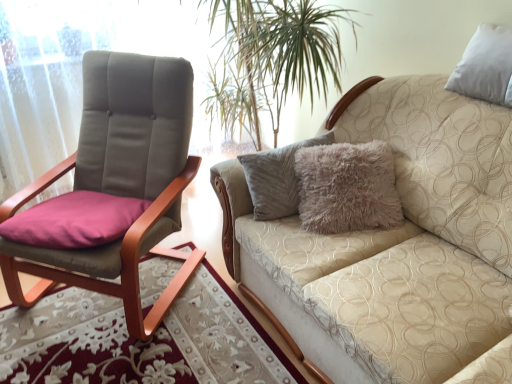
Question: From a real-world perspective, does matte gray fabric chair at left stand above beige textured couch at upper right?

Choices:
 (A) no
 (B) yes

Answer: (B)

Question: Is matte gray fabric chair at left wider than beige textured couch at upper right?

Choices:
 (A) yes
 (B) no

Answer: (B)

Question: Considering the relative positions of matte gray fabric chair at left and beige textured couch at upper right in the image provided, is matte gray fabric chair at left to the left of beige textured couch at upper right from the viewer's perspective?

Choices:
 (A) yes
 (B) no

Answer: (A)

Question: Can you see matte gray fabric chair at left touching beige textured couch at upper right?

Choices:
 (A) no
 (B) yes

Answer: (A)

Question: Considering the relative sizes of matte gray fabric chair at left and beige textured couch at upper right in the image provided, is matte gray fabric chair at left smaller than beige textured couch at upper right?

Choices:
 (A) no
 (B) yes

Answer: (B)

Question: Considering the relative sizes of matte gray fabric chair at left and beige textured couch at upper right in the image provided, is matte gray fabric chair at left thinner than beige textured couch at upper right?

Choices:
 (A) yes
 (B) no

Answer: (A)

Question: Is beige textured couch at upper right positioned beyond the bounds of matte gray fabric chair at left?

Choices:
 (A) no
 (B) yes

Answer: (B)

Question: Is beige textured couch at upper right to the right of matte gray fabric chair at left from the viewer's perspective?

Choices:
 (A) no
 (B) yes

Answer: (B)

Question: Is beige textured couch at upper right bigger than matte gray fabric chair at left?

Choices:
 (A) no
 (B) yes

Answer: (B)

Question: Is beige textured couch at upper right further to camera compared to matte gray fabric chair at left?

Choices:
 (A) yes
 (B) no

Answer: (B)

Question: Is beige textured couch at upper right closer to the viewer compared to matte gray fabric chair at left?

Choices:
 (A) no
 (B) yes

Answer: (B)

Question: Can you confirm if beige textured couch at upper right is thinner than matte gray fabric chair at left?

Choices:
 (A) yes
 (B) no

Answer: (B)

Question: From a real-world perspective, is beige textured couch at upper right positioned above or below matte gray fabric chair at left?

Choices:
 (A) below
 (B) above

Answer: (A)